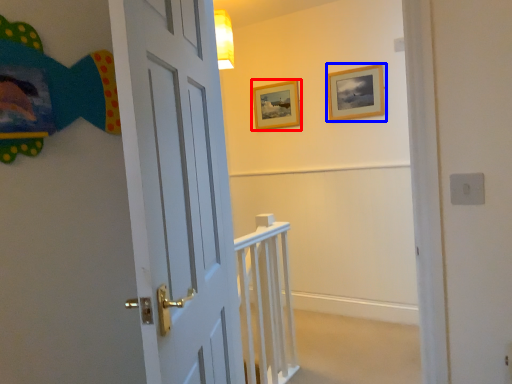
Question: Which object appears farthest to the camera in this image, picture frame (highlighted by a red box) or picture frame (highlighted by a blue box)?

Choices:
 (A) picture frame
 (B) picture frame

Answer: (A)